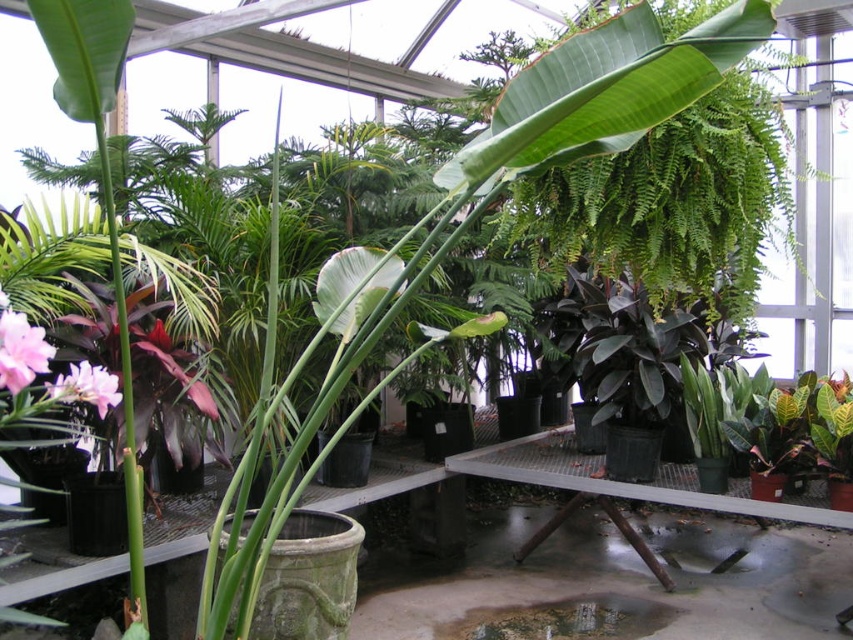
You are a gardener in the greenhouse and need to water the pink matte flower at lower left and the pink matte flower at center. Which one is positioned to the right of the other?

The pink matte flower at lower left is positioned to the right of the pink matte flower at center.

You are a gardener entering the greenhouse and want to water both the pink matte flower at lower left and the pink matte flower at center. Which flower should you water first if you want to start with the one nearest to you?

The pink matte flower at lower left is closer to the viewer, so you should water it first.